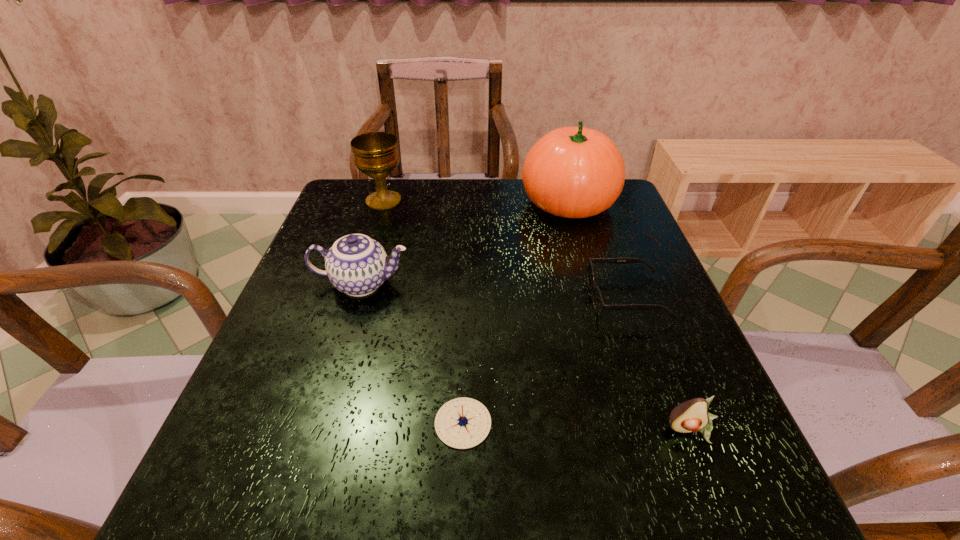
Locate an element on the screen. This screenshot has height=540, width=960. free space located at the front lenses of the sunglasses is located at coordinates (520, 298).

At what (x,y) coordinates should I click in order to perform the action: click on free region located 0.250m at the front lenses of the sunglasses. Please return your answer as a coordinate pair (x, y). The image size is (960, 540). Looking at the image, I should click on (473, 298).

At what (x,y) coordinates should I click in order to perform the action: click on free space located 0.230m at the front lenses of the sunglasses. Please return your answer as a coordinate pair (x, y). Looking at the image, I should click on (483, 298).

Identify the location of free space located 0.220m on the back of the compass. The height and width of the screenshot is (540, 960). (467, 308).

At what (x,y) coordinates should I click in order to perform the action: click on pumpkin that is at the far edge. Please return your answer as a coordinate pair (x, y). Looking at the image, I should click on point(574,172).

Locate an element on the screen. The width and height of the screenshot is (960, 540). chalice that is at the far edge is located at coordinates (376, 154).

Image resolution: width=960 pixels, height=540 pixels. I want to click on chalice at the left edge, so click(376, 154).

The height and width of the screenshot is (540, 960). In order to click on chinaware at the left edge in this screenshot , I will do `click(357, 265)`.

You are a GUI agent. You are given a task and a screenshot of the screen. Output one action in this format:
    pyautogui.click(x=<x>, y=<y>)
    Task: Click on the pumpkin at the right edge
    Image resolution: width=960 pixels, height=540 pixels.
    Given the screenshot: What is the action you would take?
    pyautogui.click(x=574, y=172)

Identify the location of avocado situated at the right edge. (690, 416).